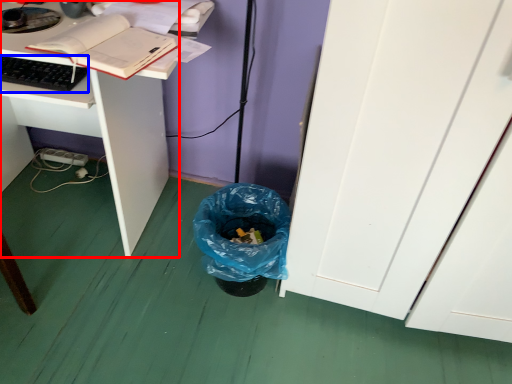
Question: Which object appears farthest to the camera in this image, desk (highlighted by a red box) or computer keyboard (highlighted by a blue box)?

Choices:
 (A) desk
 (B) computer keyboard

Answer: (B)